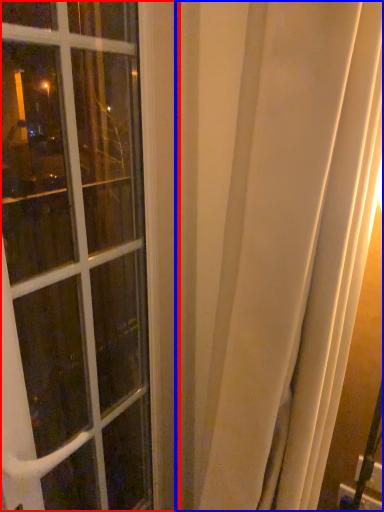
Question: Which object is further to the camera taking this photo, window (highlighted by a red box) or curtain (highlighted by a blue box)?

Choices:
 (A) window
 (B) curtain

Answer: (A)